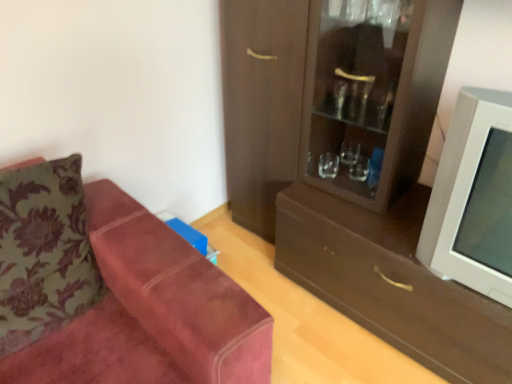
Question: Should I look upward or downward to see matte brown cabinet at right?

Choices:
 (A) up
 (B) down

Answer: (A)

Question: Can you confirm if velvet floral pillow at left is taller than suede couch at left?

Choices:
 (A) no
 (B) yes

Answer: (A)

Question: From the image's perspective, would you say velvet floral pillow at left is shown under suede couch at left?

Choices:
 (A) no
 (B) yes

Answer: (A)

Question: Is velvet floral pillow at left not inside suede couch at left?

Choices:
 (A) no
 (B) yes

Answer: (A)

Question: From a real-world perspective, is velvet floral pillow at left under suede couch at left?

Choices:
 (A) no
 (B) yes

Answer: (A)

Question: Would you consider velvet floral pillow at left to be distant from suede couch at left?

Choices:
 (A) no
 (B) yes

Answer: (A)

Question: Can you confirm if velvet floral pillow at left is thinner than suede couch at left?

Choices:
 (A) no
 (B) yes

Answer: (B)

Question: Would you say suede couch at left is a long distance from velvet floral pillow at left?

Choices:
 (A) no
 (B) yes

Answer: (A)

Question: Considering the relative sizes of suede couch at left and velvet floral pillow at left in the image provided, is suede couch at left wider than velvet floral pillow at left?

Choices:
 (A) yes
 (B) no

Answer: (A)

Question: Is suede couch at left not inside velvet floral pillow at left?

Choices:
 (A) yes
 (B) no

Answer: (A)

Question: Is suede couch at left bigger than velvet floral pillow at left?

Choices:
 (A) yes
 (B) no

Answer: (A)

Question: From the image's perspective, is suede couch at left below velvet floral pillow at left?

Choices:
 (A) no
 (B) yes

Answer: (B)

Question: Is suede couch at left behind velvet floral pillow at left?

Choices:
 (A) no
 (B) yes

Answer: (A)

Question: Is velvet floral pillow at left taller than brown matte drawer at center?

Choices:
 (A) no
 (B) yes

Answer: (B)